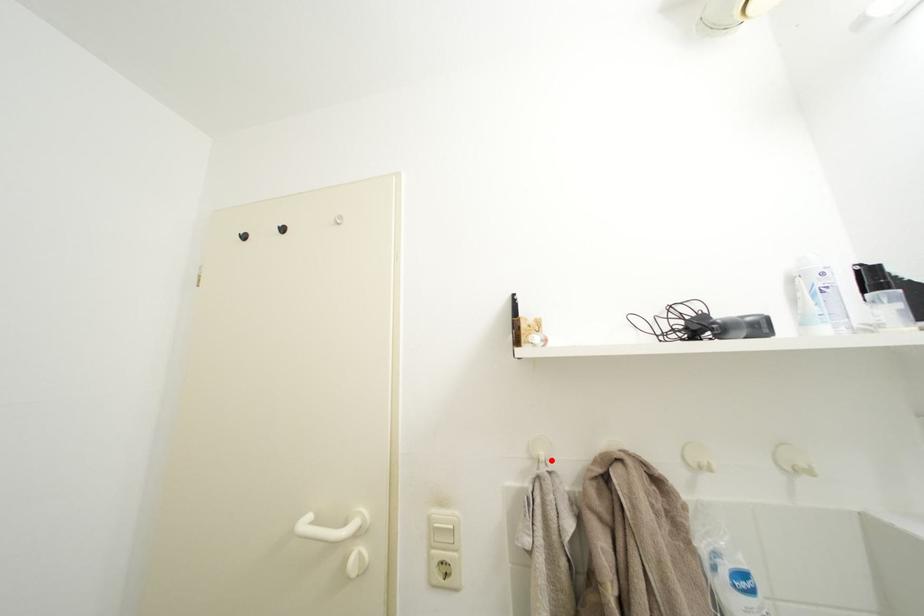
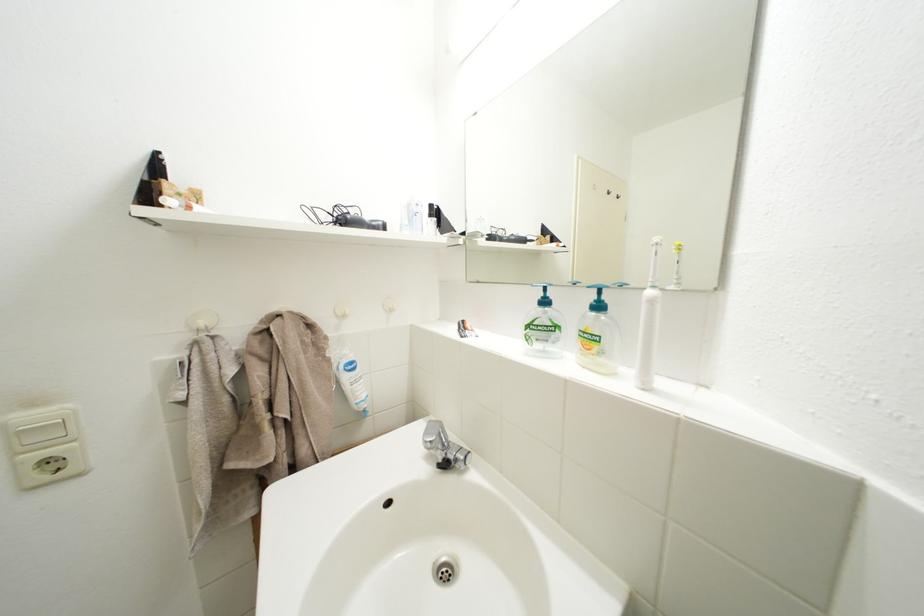
Find the pixel in the second image that matches the highlighted location in the first image.

(211, 329)